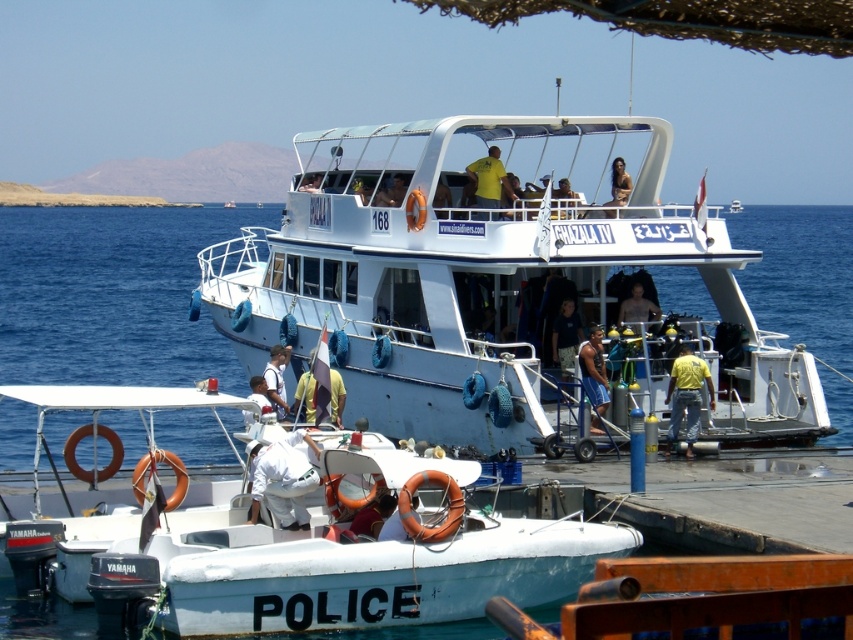
Question: Considering the real-world distances, which object is closest to the yellow fabric shirt at upper center?

Choices:
 (A) white matte boat at center
 (B) yellow matte shirt at upper center

Answer: (B)

Question: Based on their relative distances, which object is farther from the blue water at center?

Choices:
 (A) blue denim shorts at center
 (B) white matte boat at center
 (C) white fabric shirt at center
 (D) white matte police boat at lower left

Answer: (C)

Question: Which point is farther to the camera?

Choices:
 (A) (683, 392)
 (B) (566, 212)
 (C) (618, 188)

Answer: (C)

Question: Where is yellow fabric flag at center located in relation to white fabric shirt at center in the image?

Choices:
 (A) left
 (B) right

Answer: (B)

Question: Is matte yellow shirt at center bigger than brown textured fabric at upper center?

Choices:
 (A) no
 (B) yes

Answer: (A)

Question: In this image, where is yellow fabric flag at center located relative to brown textured fabric at upper center?

Choices:
 (A) above
 (B) below

Answer: (B)